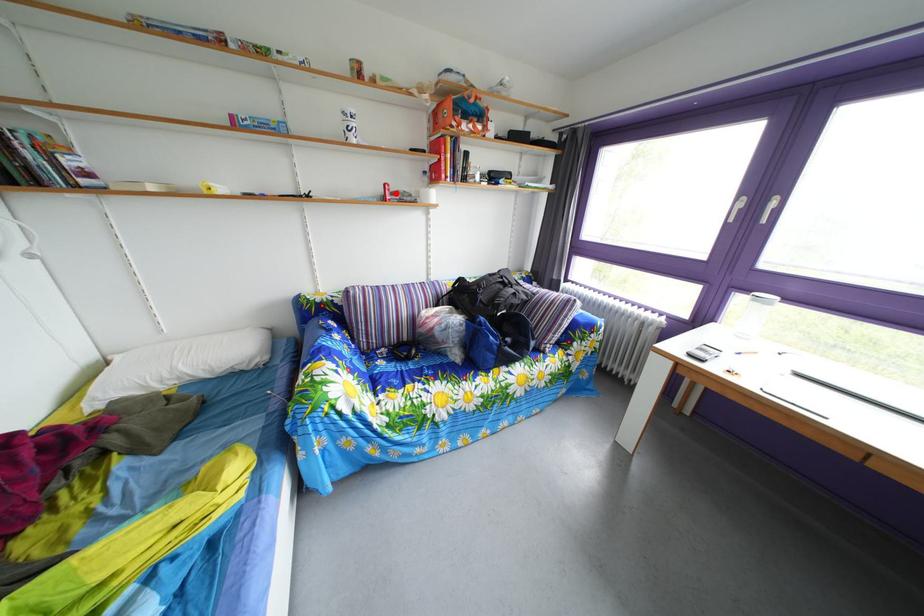
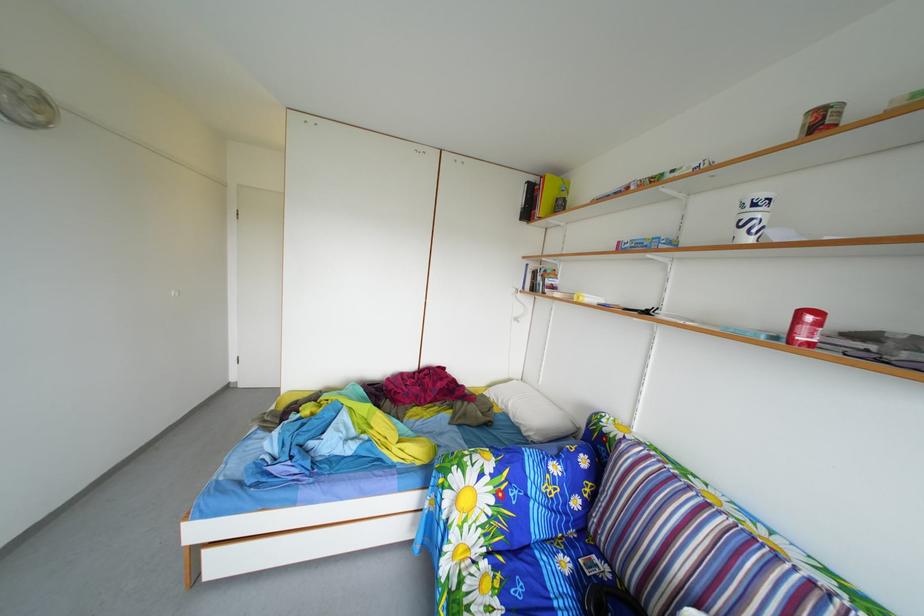
Question: I am providing you with two images of the same scene from different viewpoints. A red point is shown in image1. For the corresponding object point in image2, is it positioned nearer or farther from the camera?

Choices:
 (A) Nearer
 (B) Farther

Answer: (B)